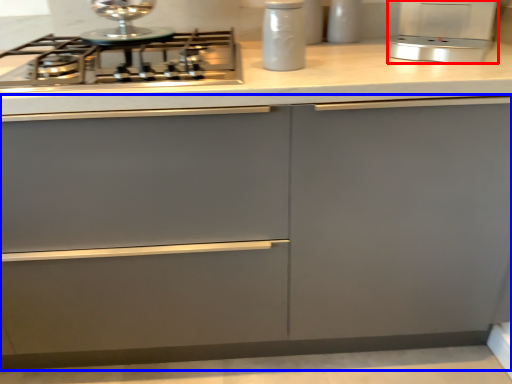
Question: Which point is closer to the camera, kitchen appliance (highlighted by a red box) or cabinetry (highlighted by a blue box)?

Choices:
 (A) kitchen appliance
 (B) cabinetry

Answer: (B)